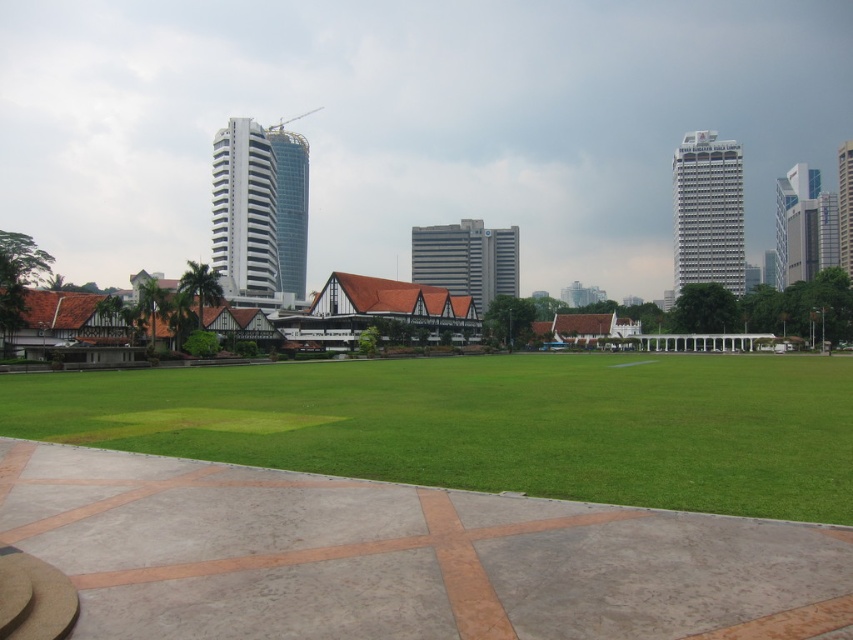
Which is behind, point (456, 256) or point (798, 280)?

The point (456, 256) is more distant.

Consider the image. Is gray concrete building at center below white glass skyscraper at right?

Yes.

Which is in front, point (432, 262) or point (776, 266)?

Point (432, 262) is more forward.

This screenshot has width=853, height=640. What are the coordinates of `gray concrete building at center` in the screenshot? It's located at (467, 259).

Is gray concrete building at center in front of glassy modern skyscraper at right?

Yes.

Who is lower down, gray concrete building at center or glassy modern skyscraper at right?

gray concrete building at center is below.

The image size is (853, 640). What are the coordinates of `gray concrete building at center` in the screenshot? It's located at (467, 259).

Is white glossy building at upper right positioned before white glass skyscraper at right?

Yes.

Who is more forward, [672,202] or [822,212]?

Positioned in front is point [822,212].

Which is behind, point (686, 193) or point (834, 221)?

Point (834, 221)

I want to click on white glossy building at upper right, so click(706, 212).